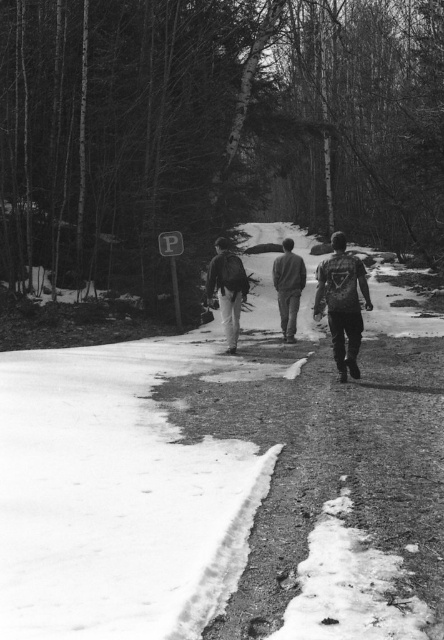
Question: Which point appears closest to the camera in this image?

Choices:
 (A) (284, 257)
 (B) (225, 276)

Answer: (B)

Question: Estimate the real-world distances between objects in this image. Which object is farther from the dark gray fabric jacket at center?

Choices:
 (A) dark gray fabric backpack at center
 (B) matte black jacket at center

Answer: (A)

Question: Is matte black jacket at center smaller than dark gray fabric jacket at center?

Choices:
 (A) yes
 (B) no

Answer: (A)

Question: Is dark gray fabric backpack at center further to the viewer compared to matte black jacket at center?

Choices:
 (A) no
 (B) yes

Answer: (A)

Question: Can you confirm if matte black jacket at center is positioned above dark gray fabric jacket at center?

Choices:
 (A) yes
 (B) no

Answer: (B)

Question: Among these objects, which one is farthest from the camera?

Choices:
 (A) dark gray fabric backpack at center
 (B) matte black jacket at center

Answer: (B)